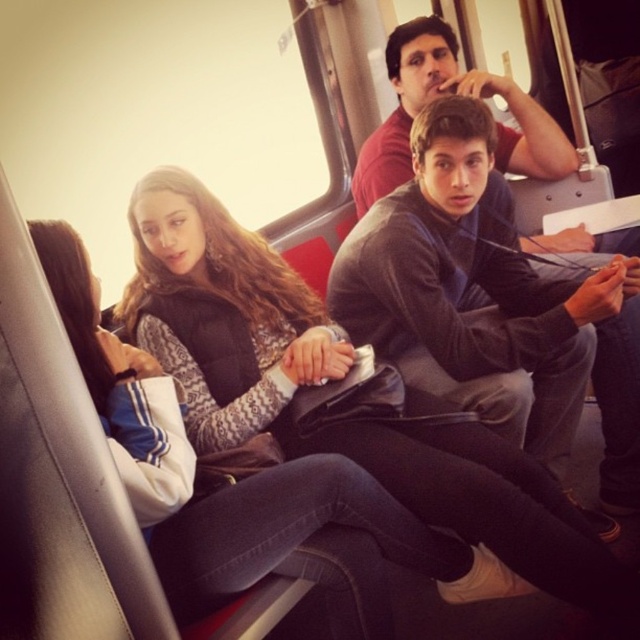
You are a passenger on a bus and you see a suede black jacket at center and a dark gray sweater at center. Which one is bigger in size?

The suede black jacket at center is larger in size compared to the dark gray sweater at center.

You are standing at point (508, 106) and want to walk to the front of the vehicle. Which direction should you move relative to point (508, 461)?

You should move towards point (508, 461) because it is in front of point (508, 106), so moving in that direction will take you toward the front of the vehicle.

You are a passenger on a bus and you see the suede black jacket at center and the dark gray sweater at center. Which clothing item is closer to your view?

The suede black jacket at center is positioned under the dark gray sweater at center, so the dark gray sweater at center is closer to your view.